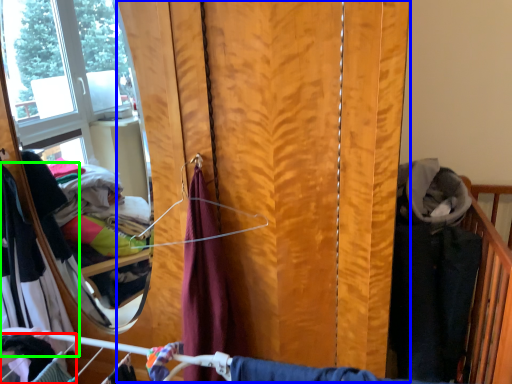
Question: Considering the real-world distances, which object is farthest from clothing (highlighted by a red box)? curtain (highlighted by a blue box) or clothing (highlighted by a green box)?

Choices:
 (A) curtain
 (B) clothing

Answer: (A)